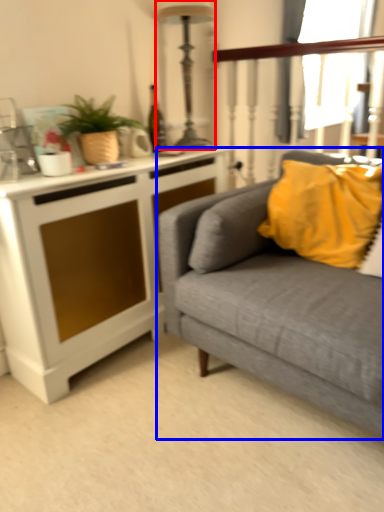
Question: Which object is closer to the camera taking this photo, lamp (highlighted by a red box) or studio couch (highlighted by a blue box)?

Choices:
 (A) lamp
 (B) studio couch

Answer: (B)